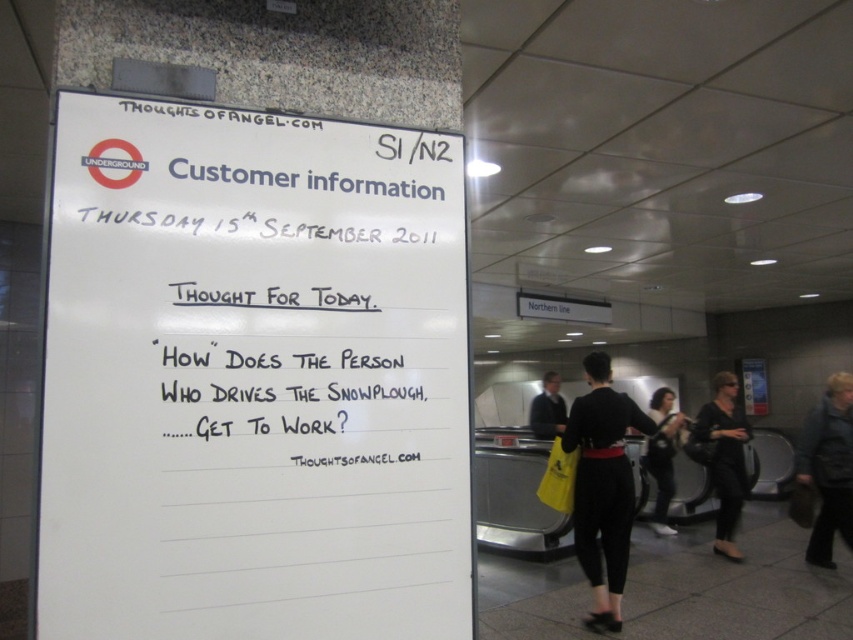
You are standing in front of the whiteboard in the subway station and notice two points marked on it. The first point is at coordinate (x=619, y=624) and the second is at (x=811, y=428). Which point is closer to you?

The point at coordinate (x=619, y=624) is closer to you than the point at (x=811, y=428).

Looking at this image, you are a fashion designer observing the whiteboard in a subway station. You notice the black fabric pants at lower center and the black leather jacket at lower right. Which item of clothing appears bigger in size?

The black fabric pants at lower center has a larger size compared to the black leather jacket at lower right.

You are a fashion designer observing the subway station scene. You notice the black fabric pants at lower center and the black leather jacket at right. Which item of clothing appears smaller in size?

The black fabric pants at lower center have a smaller size compared to the black leather jacket at right.